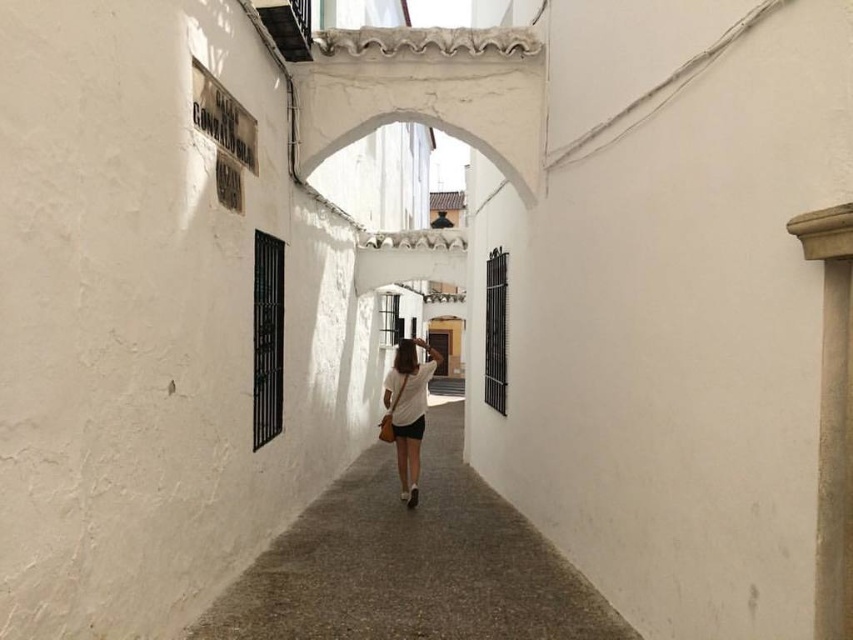
Question: Which object is farther from the camera taking this photo?

Choices:
 (A) white cotton shirt at center
 (B) smooth concrete path at center

Answer: (A)

Question: In this image, where is smooth concrete path at center located relative to white cotton shirt at center?

Choices:
 (A) above
 (B) below

Answer: (B)

Question: Considering the relative positions of smooth concrete path at center and white cotton shirt at center in the image provided, where is smooth concrete path at center located with respect to white cotton shirt at center?

Choices:
 (A) left
 (B) right

Answer: (B)

Question: Does smooth concrete path at center appear on the right side of white cotton shirt at center?

Choices:
 (A) no
 (B) yes

Answer: (B)

Question: Which object is closer to the camera taking this photo?

Choices:
 (A) smooth concrete path at center
 (B) white cotton shirt at center

Answer: (A)

Question: Which of the following is the closest to the observer?

Choices:
 (A) (408, 387)
 (B) (335, 512)

Answer: (B)